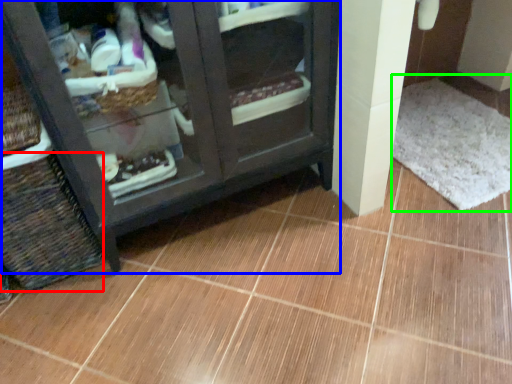
Question: Which object is the closest to the basket (highlighted by a red box)? Choose among these: furniture (highlighted by a blue box) or bath mat (highlighted by a green box).

Choices:
 (A) furniture
 (B) bath mat

Answer: (A)